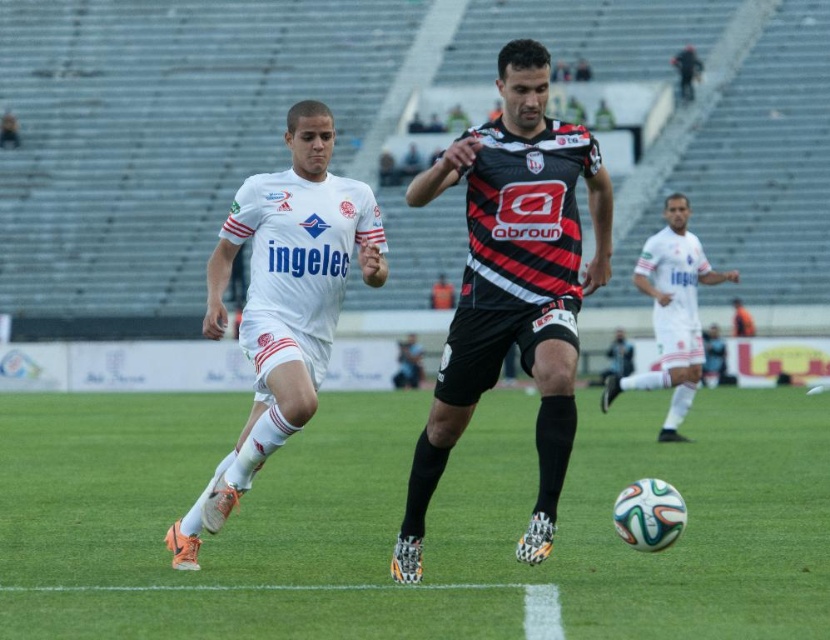
Question: Based on their relative distances, which object is farther from the black jersey at center?

Choices:
 (A) white matte uniform at center
 (B) green grass at center
 (C) white matte soccer player at center

Answer: (C)

Question: Which point appears farthest from the camera in this image?

Choices:
 (A) (491, 605)
 (B) (269, 416)
 (C) (642, 282)

Answer: (C)

Question: Does green grass at center come behind white matte soccer player at center?

Choices:
 (A) yes
 (B) no

Answer: (B)

Question: Is black jersey at center to the right of white matte uniform at center from the viewer's perspective?

Choices:
 (A) no
 (B) yes

Answer: (B)

Question: Which of the following is the farthest from the observer?

Choices:
 (A) white matte uniform at center
 (B) black jersey at center

Answer: (A)

Question: Is black jersey at center thinner than white matte uniform at center?

Choices:
 (A) no
 (B) yes

Answer: (B)